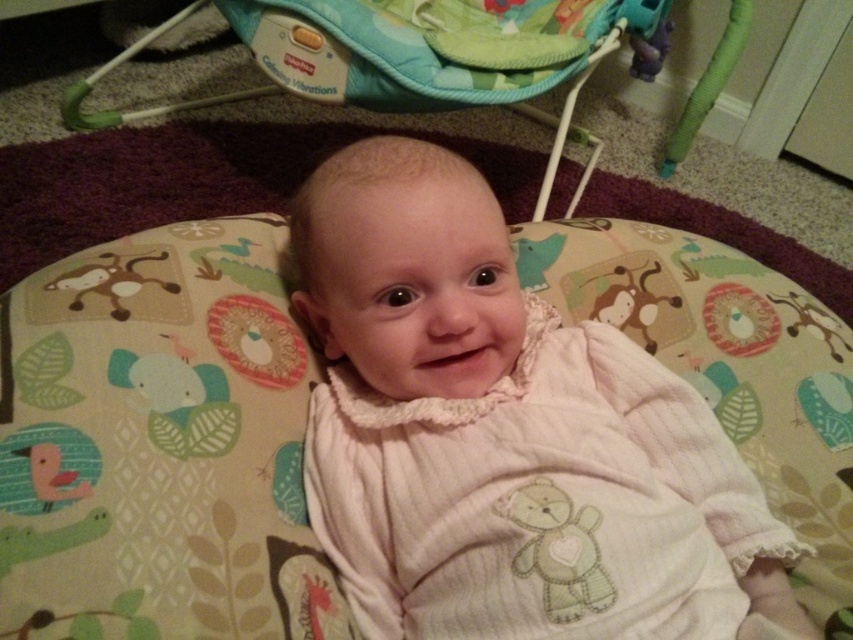
Question: Is white soft fabric baby at center in front of teal fabric baby swing at upper center?

Choices:
 (A) yes
 (B) no

Answer: (A)

Question: Does white soft fabric baby at center have a smaller size compared to teal fabric baby swing at upper center?

Choices:
 (A) yes
 (B) no

Answer: (A)

Question: Which object is positioned farthest from the white soft fabric baby at center?

Choices:
 (A) green plastic baby swing at upper center
 (B) teal fabric baby swing at upper center

Answer: (A)

Question: Does white soft fabric baby at center have a larger size compared to teal fabric baby swing at upper center?

Choices:
 (A) no
 (B) yes

Answer: (A)

Question: Which object appears farthest from the camera in this image?

Choices:
 (A) green plastic baby swing at upper center
 (B) white soft fabric baby at center
 (C) teal fabric baby swing at upper center

Answer: (A)

Question: Which point appears farthest from the camera in this image?

Choices:
 (A) (311, 227)
 (B) (651, 38)

Answer: (B)